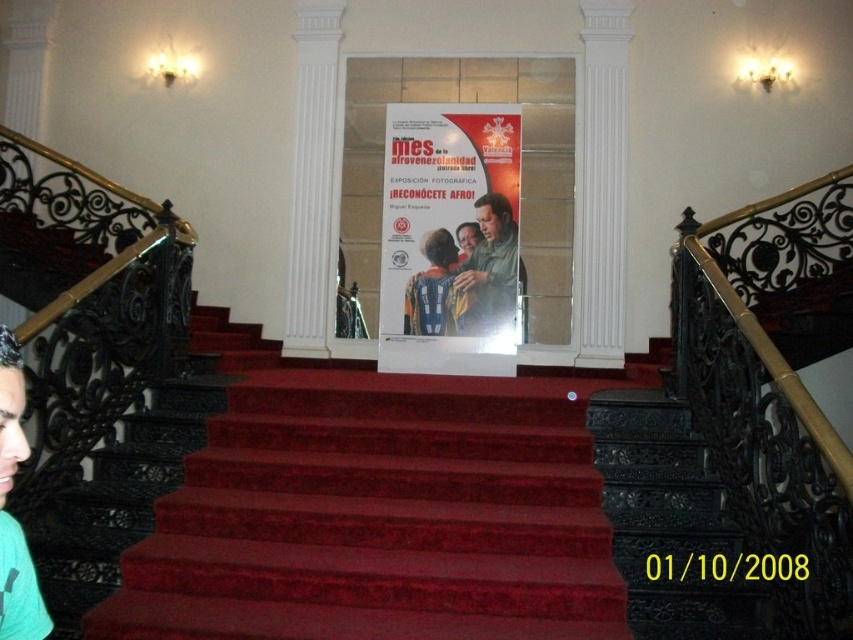
Question: Which object is positioned closest to the matte green shirt at center?

Choices:
 (A) blue fabric shirt at center
 (B) matte paper poster at center

Answer: (B)

Question: Is matte paper poster at center positioned before matte green shirt at center?

Choices:
 (A) no
 (B) yes

Answer: (B)

Question: Is matte green shirt at center positioned at the back of blue fabric shirt at center?

Choices:
 (A) yes
 (B) no

Answer: (B)

Question: Is green t-shirt at lower left above matte green shirt at center?

Choices:
 (A) no
 (B) yes

Answer: (A)

Question: Which object is the closest to the blue fabric shirt at center?

Choices:
 (A) matte paper poster at center
 (B) matte green shirt at center

Answer: (A)

Question: Which point is closer to the camera?

Choices:
 (A) green t-shirt at lower left
 (B) blue fabric shirt at center

Answer: (A)